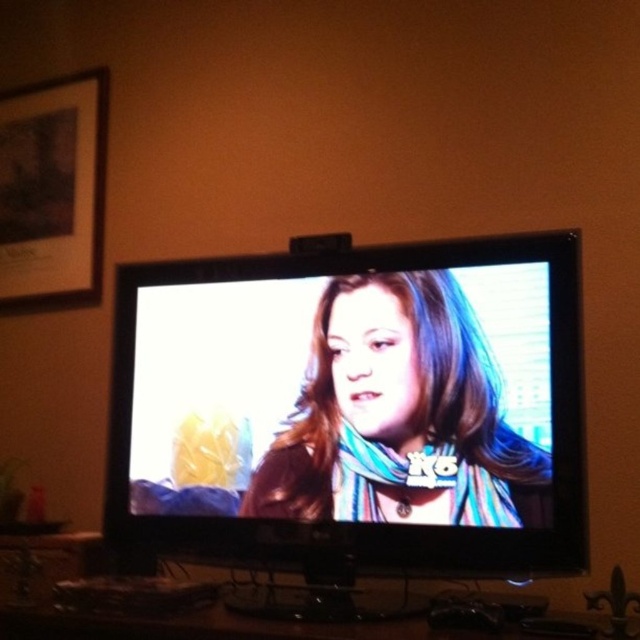
Question: Is matte brown leather jacket at center further to camera compared to wooden framed picture at upper left?

Choices:
 (A) no
 (B) yes

Answer: (A)

Question: Which point is farther to the camera?

Choices:
 (A) (280, 484)
 (B) (358, 554)

Answer: (A)

Question: Can you confirm if flat-screen tv at center is positioned above wooden framed picture at upper left?

Choices:
 (A) no
 (B) yes

Answer: (A)

Question: Which point appears farthest from the camera in this image?

Choices:
 (A) pyautogui.click(x=97, y=102)
 (B) pyautogui.click(x=428, y=387)
 (C) pyautogui.click(x=502, y=440)

Answer: (A)

Question: Does flat-screen tv at center appear under matte brown leather jacket at center?

Choices:
 (A) yes
 (B) no

Answer: (B)

Question: Which object appears closest to the camera in this image?

Choices:
 (A) flat-screen tv at center
 (B) wooden framed picture at upper left

Answer: (A)